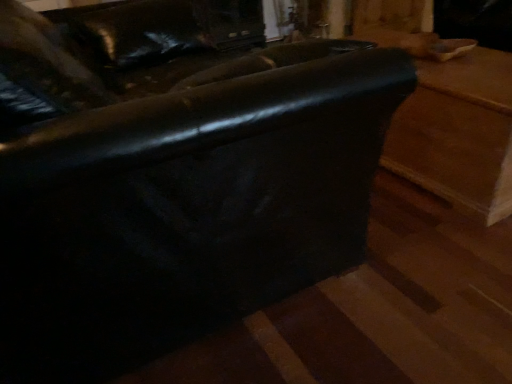
Where is `free space in front of wooden chest at right`? The height and width of the screenshot is (384, 512). free space in front of wooden chest at right is located at coordinates (413, 265).